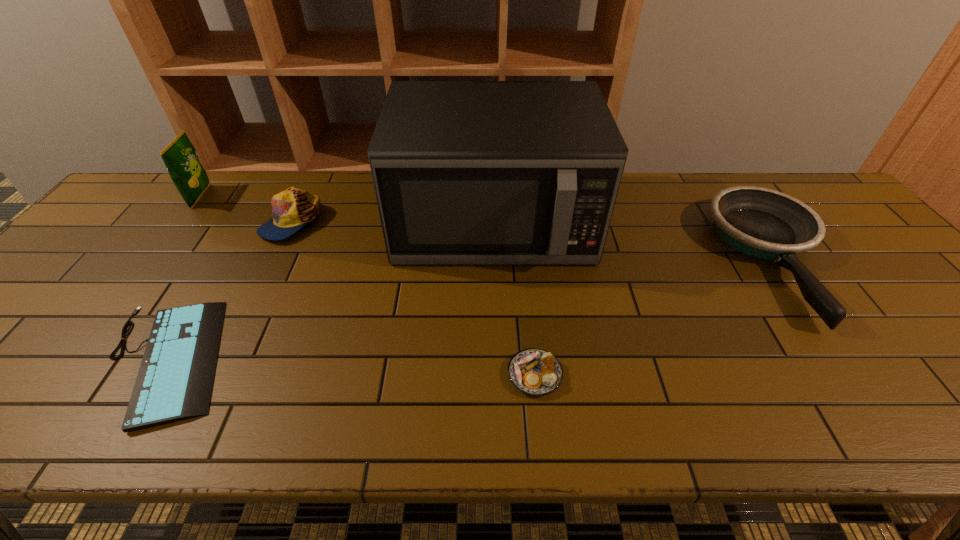
I want to click on free space located on the bill of the cap, so click(x=258, y=290).

This screenshot has width=960, height=540. In order to click on blank area located 0.060m on the handle side of the frying pan in this screenshot , I will do `click(843, 357)`.

At what (x,y) coordinates should I click in order to perform the action: click on vacant space situated 0.050m on the front of the fifth tallest object. Please return your answer as a coordinate pair (x, y). Looking at the image, I should click on (540, 423).

Locate an element on the screen. blank space located on the back of the shortest object is located at coordinates (239, 239).

Locate an element on the screen. microwave oven present at the far edge is located at coordinates (465, 172).

Locate an element on the screen. The image size is (960, 540). crisp (potato chip) located at the far edge is located at coordinates (180, 157).

Locate an element on the screen. Image resolution: width=960 pixels, height=540 pixels. cap that is at the far edge is located at coordinates (293, 208).

Locate an element on the screen. frying pan at the far edge is located at coordinates (763, 223).

At what (x,y) coordinates should I click in order to perform the action: click on pastry positioned at the near edge. Please return your answer as a coordinate pair (x, y). Looking at the image, I should click on (536, 372).

This screenshot has width=960, height=540. Find the location of `computer keyboard at the near edge`. computer keyboard at the near edge is located at coordinates (175, 379).